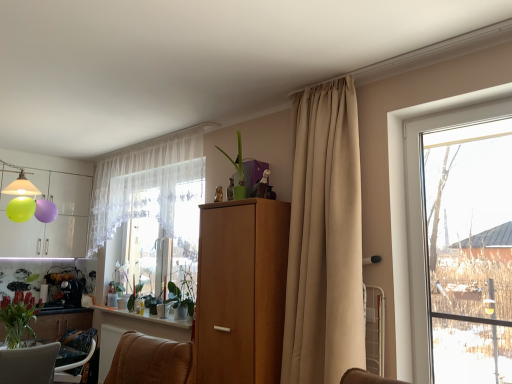
Find the location of `free point above beige fabric curtain at center, which appears as the second curtain when viewed from the left (from a real-world perspective)`. free point above beige fabric curtain at center, which appears as the second curtain when viewed from the left (from a real-world perspective) is located at coordinates (315, 76).